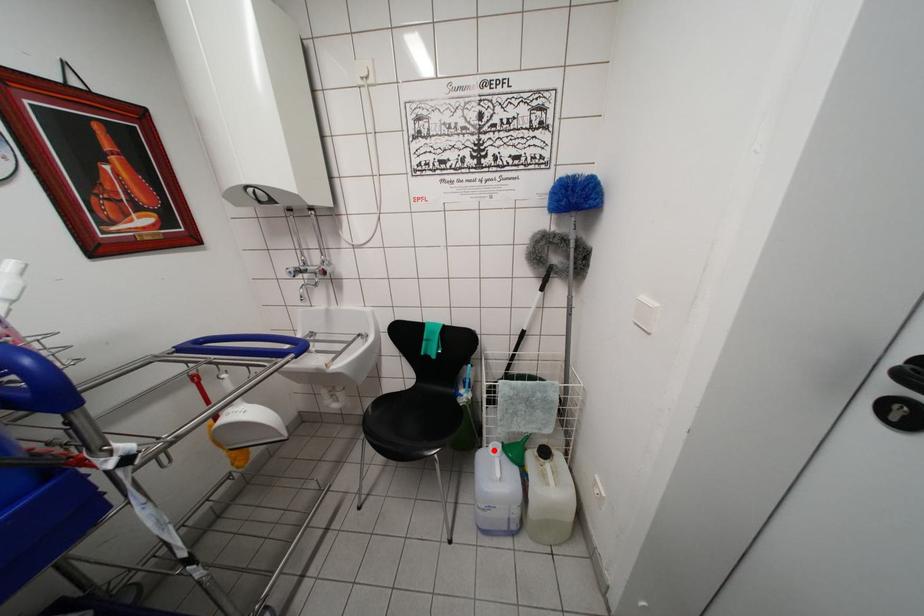
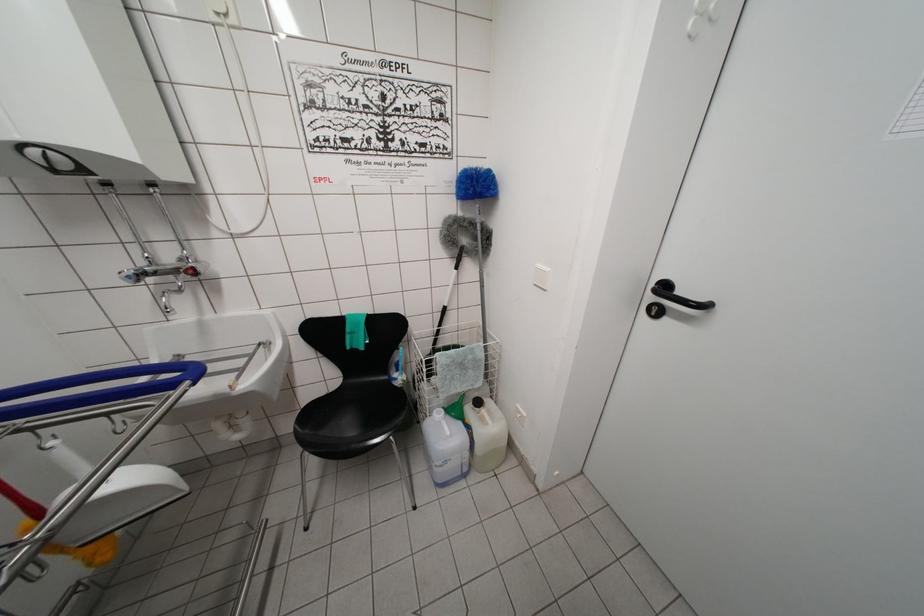
In the second image, find the point that corresponds to the highlighted location in the first image.

(438, 418)